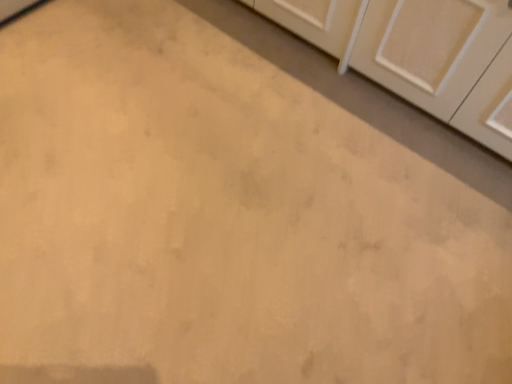
What do you see at coordinates (409, 47) in the screenshot? The image size is (512, 384). I see `white matte cabinet at upper right` at bounding box center [409, 47].

You are a GUI agent. You are given a task and a screenshot of the screen. Output one action in this format:
    pyautogui.click(x=<x>, y=<y>)
    Task: Click on the white matte cabinet at upper right
    The width and height of the screenshot is (512, 384).
    Given the screenshot: What is the action you would take?
    pyautogui.click(x=409, y=47)

Identify the location of white matte cabinet at upper right. The width and height of the screenshot is (512, 384). coord(409,47).